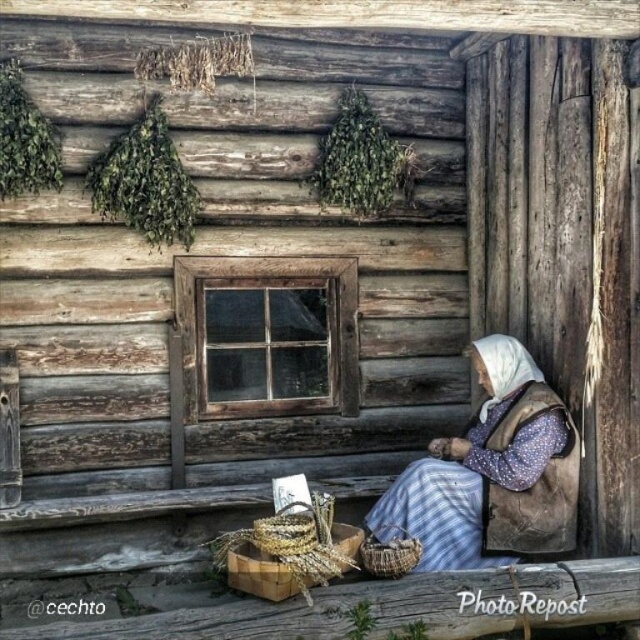
Does blue plaid dress at lower right have a lesser height compared to natural woven basket at lower center?

No.

Where is `blue plaid dress at lower right`? blue plaid dress at lower right is located at coordinates (490, 472).

Which is in front, point (508, 417) or point (346, 547)?

Point (346, 547)

The height and width of the screenshot is (640, 640). What are the coordinates of `blue plaid dress at lower right` in the screenshot? It's located at (490, 472).

Does natural woven basket at lower center have a greater height compared to woven brown basket at lower center?

Yes.

Who is more distant from viewer, (250, 593) or (392, 547)?

Point (392, 547)

Which is in front, point (323, 538) or point (401, 563)?

Positioned in front is point (401, 563).

This screenshot has width=640, height=640. I want to click on natural woven basket at lower center, so click(x=291, y=554).

The image size is (640, 640). In order to click on blue plaid dress at lower right in this screenshot , I will do `click(490, 472)`.

Who is more distant from viewer, [520,541] or [403,566]?

The point [520,541] is behind.

What do you see at coordinates (490, 472) in the screenshot? The image size is (640, 640). I see `blue plaid dress at lower right` at bounding box center [490, 472].

Identify the location of blue plaid dress at lower right. The height and width of the screenshot is (640, 640). (490, 472).